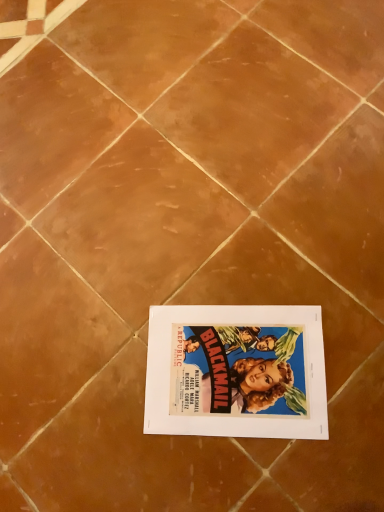
Image resolution: width=384 pixels, height=512 pixels. I want to click on white paper at center, so click(236, 372).

What do you see at coordinates (236, 372) in the screenshot?
I see `white paper at center` at bounding box center [236, 372].

Locate an element on the screen. The width and height of the screenshot is (384, 512). white paper at center is located at coordinates (236, 372).